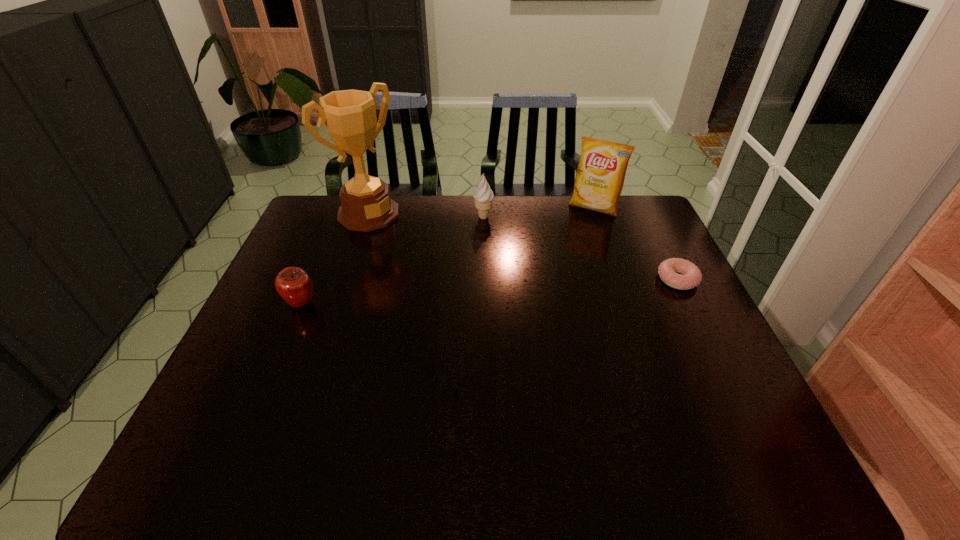
The image size is (960, 540). Identify the location of apple. (295, 286).

Locate an element on the screen. the rightmost object is located at coordinates (668, 270).

Locate an element on the screen. doughnut is located at coordinates (668, 270).

This screenshot has width=960, height=540. Identify the location of the third object from right to left. (483, 196).

The width and height of the screenshot is (960, 540). I want to click on the third tallest object, so click(x=483, y=196).

You are a GUI agent. You are given a task and a screenshot of the screen. Output one action in this format:
    pyautogui.click(x=<x>, y=<y>)
    Task: Click on the award
    
    Given the screenshot: What is the action you would take?
    pyautogui.click(x=350, y=115)

Where is `the second object from right to left`? The width and height of the screenshot is (960, 540). the second object from right to left is located at coordinates (600, 175).

Locate an element on the screen. The image size is (960, 540). the second tallest object is located at coordinates (600, 175).

Identify the location of free location located 0.070m on the left of the second shortest object. This screenshot has height=540, width=960. (259, 303).

Image resolution: width=960 pixels, height=540 pixels. Identify the location of vacant area located 0.060m on the left of the rightmost object. (636, 279).